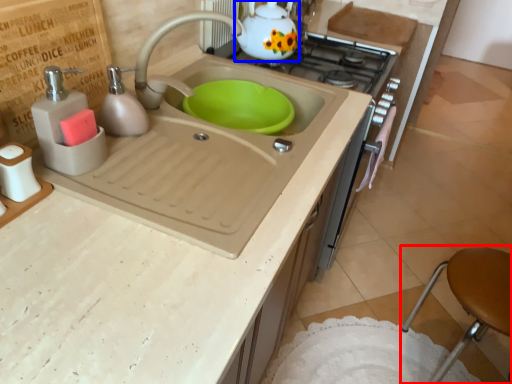
Question: Which object appears farthest to the camera in this image, bar stool (highlighted by a red box) or tea pot (highlighted by a blue box)?

Choices:
 (A) bar stool
 (B) tea pot

Answer: (B)